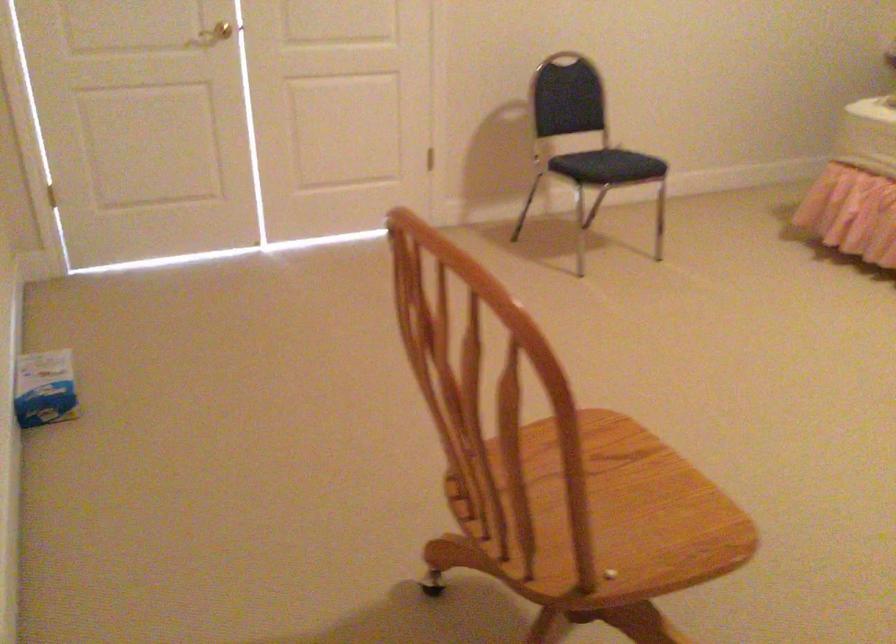
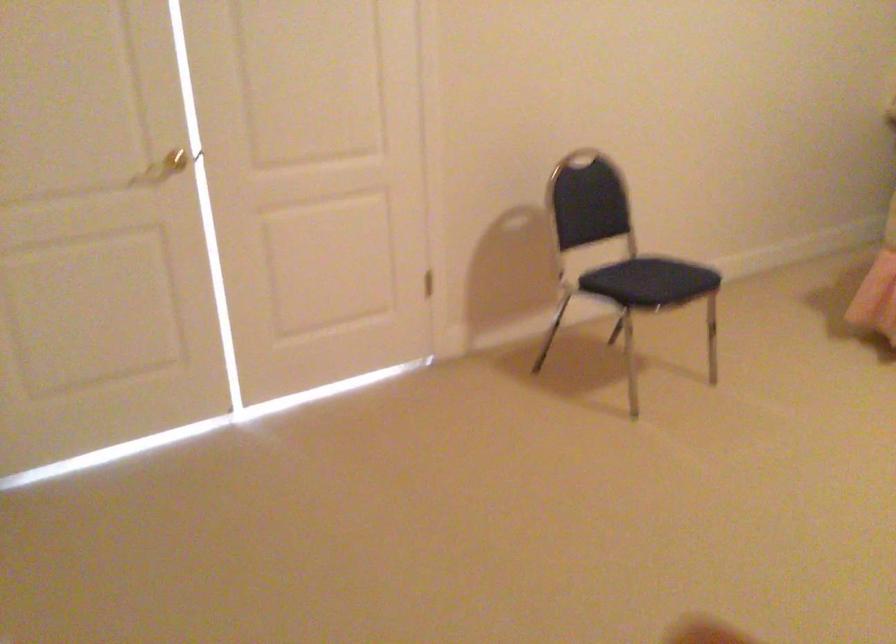
Question: The images are taken continuously from a first-person perspective. In which direction is your viewpoint rotating?

Choices:
 (A) Left
 (B) Right
 (C) Up
 (D) Down

Answer: (C)